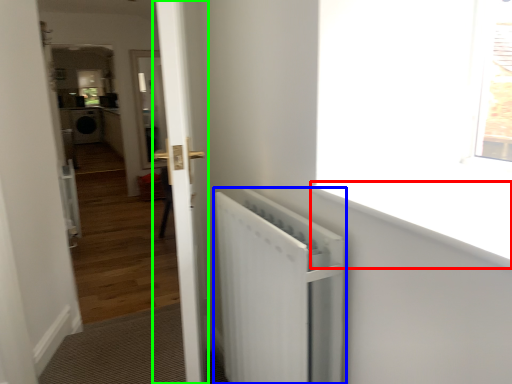
Question: Considering the real-world distances, which object is closest to window sill (highlighted by a red box)? radiator (highlighted by a blue box) or door (highlighted by a green box).

Choices:
 (A) radiator
 (B) door

Answer: (A)